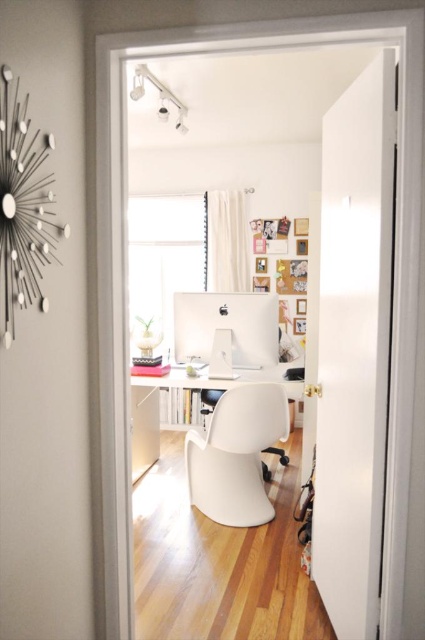
Question: Is white glossy computer at center above white plastic desk at center?

Choices:
 (A) no
 (B) yes

Answer: (B)

Question: Among these objects, which one is nearest to the camera?

Choices:
 (A) white plastic swivel chair at center
 (B) white plastic desk at center

Answer: (A)

Question: Which object is positioned closest to the white plastic desk at center?

Choices:
 (A) white plastic swivel chair at center
 (B) white glossy computer at center

Answer: (B)

Question: Observing the image, what is the correct spatial positioning of white glossy computer at center in reference to white plastic desk at center?

Choices:
 (A) left
 (B) right

Answer: (A)

Question: Is white glossy computer at center to the right of white plastic desk at center from the viewer's perspective?

Choices:
 (A) yes
 (B) no

Answer: (B)

Question: Which point appears farthest from the camera in this image?

Choices:
 (A) (265, 321)
 (B) (218, 470)

Answer: (B)